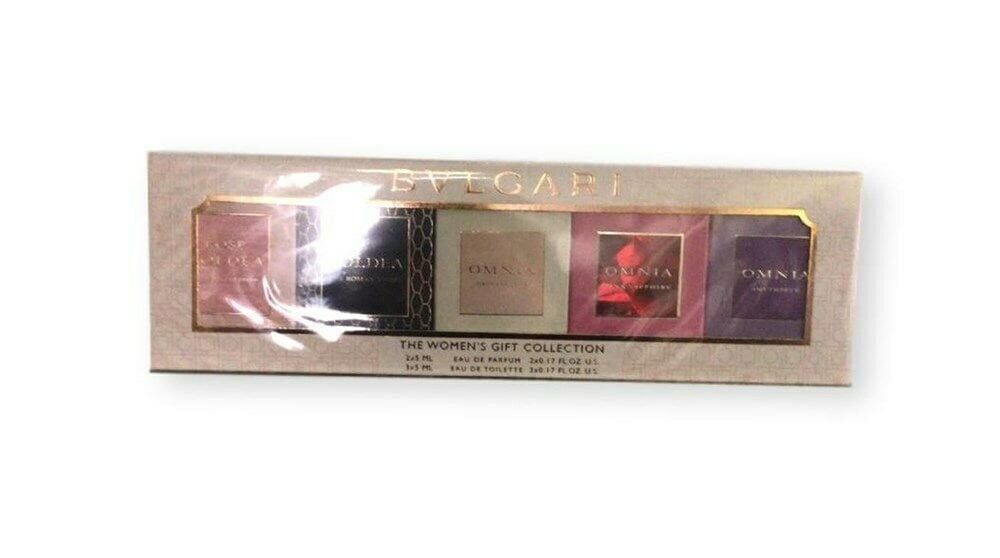
The height and width of the screenshot is (558, 1000). Identify the location of box. (278, 320).